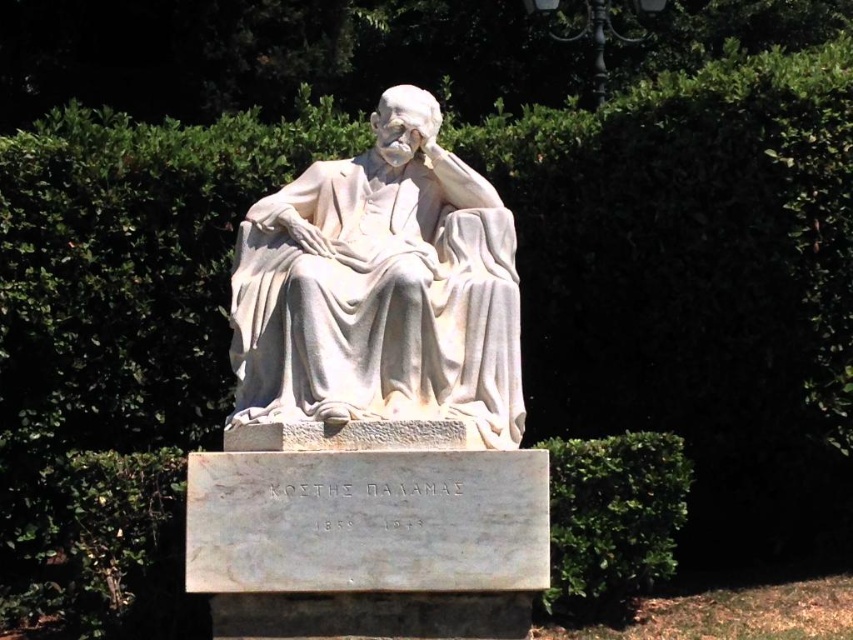
You are a photographer planning to take a photo of the white marble statue at center and the green leafy hedge at lower right. You want the statue to appear larger in the photo than the hedge. Based on their positions, which object should you move closer to the camera?

You should move closer to the white marble statue at center because it is positioned over the green leafy hedge at lower right, so moving closer to it will make it appear larger in comparison.

You are an art student who wants to sketch the white marble statue at center and the green leafy hedge at lower right. Which object is wider?

The white marble statue at center is narrower than the green leafy hedge at lower right, so the green leafy hedge at lower right is wider.